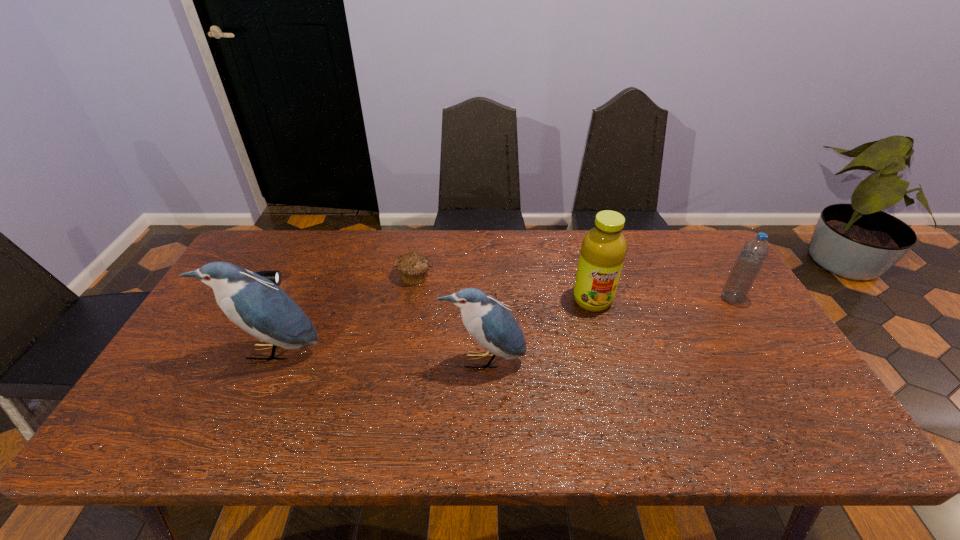
All birds are currently evenly spaced. To continue this pattern, where would you add another bird on the right? Please point out a vacant spot. Please provide its 2D coordinates. Your answer should be formatted as a tuple, i.e. [(x, y)], where the tuple contains the x and y coordinates of a point satisfying the conditions above.

[(703, 371)]